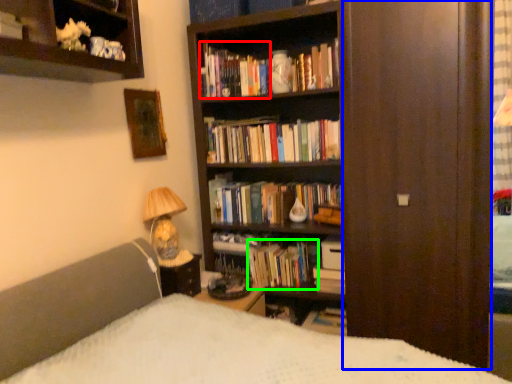
Question: Which object is positioned closest to book (highlighted by a red box)? Select from screen door (highlighted by a blue box) and book (highlighted by a green box).

Choices:
 (A) screen door
 (B) book

Answer: (A)